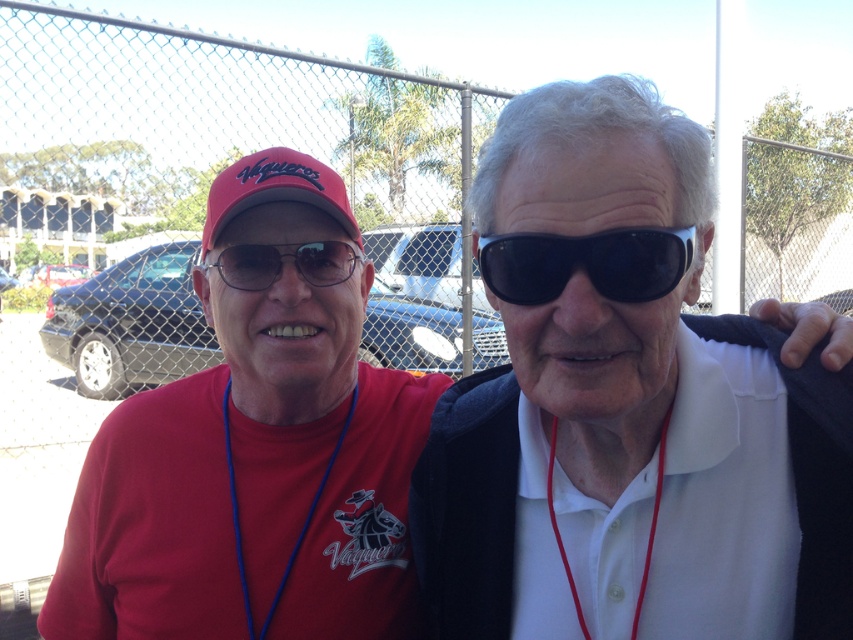
You are a photographer trying to capture the white matte sunglasses at upper right in the image. The sunglasses are located at point (630, 404). If you want to frame the sunglasses so they are centered in your shot, which direction should you adjust your camera? Consider the coordinate system where the bottom left corner is 0,0 and the top right is 1,1.

The point (630, 404) is located at the upper right of the image. To center the white matte sunglasses at upper right, you should move the camera slightly to the left and down to align the sunglasses with the center of the frame.

You are a photographer trying to capture both the matte red cap at left and the matte red baseball cap at upper left in a single frame. Which cap will appear larger in the photo?

The matte red cap at left will appear larger in the photo because it is much taller than the matte red baseball cap at upper left.

You are a photographer trying to capture both the matte red cap at left and the matte red baseball cap at upper left in a single frame. Which object should you focus on first to ensure both are in the frame?

You should focus on the matte red cap at left first because it is larger in size compared to the matte red baseball cap at upper left, ensuring it fits within the frame while also capturing the smaller one.